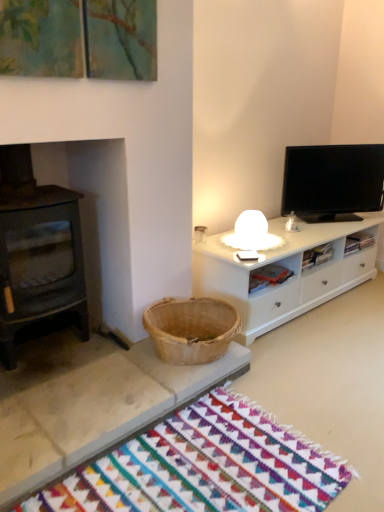
The image size is (384, 512). What do you see at coordinates (333, 181) in the screenshot?
I see `black glossy tv at upper right` at bounding box center [333, 181].

What is the approximate width of black glossy tv at upper right?

black glossy tv at upper right is 14.01 centimeters in width.

Identify the location of black glossy tv at upper right. (333, 181).

What do you see at coordinates (205, 467) in the screenshot? Image resolution: width=384 pixels, height=512 pixels. I see `multicolored woven mat at lower center` at bounding box center [205, 467].

Identify the location of multicolored woven mat at lower center. (205, 467).

At what (x,y) coordinates should I click in order to perform the action: click on black glossy tv at upper right. Please return your answer as a coordinate pair (x, y). This screenshot has height=512, width=384. Looking at the image, I should click on (333, 181).

Between black glossy tv at upper right and multicolored woven mat at lower center, which one appears on the right side from the viewer's perspective?

Positioned to the right is black glossy tv at upper right.

Is black glossy tv at upper right further to camera compared to multicolored woven mat at lower center?

Yes.

Which is nearer, (336, 196) or (67, 480)?

Point (336, 196) is positioned farther from the camera compared to point (67, 480).

From the image's perspective, is black glossy tv at upper right located above or below multicolored woven mat at lower center?

Clearly, from the image's perspective, black glossy tv at upper right is above multicolored woven mat at lower center.

From a real-world perspective, which is physically below, black glossy tv at upper right or multicolored woven mat at lower center?

multicolored woven mat at lower center.

Does black glossy tv at upper right have a lesser width compared to multicolored woven mat at lower center?

Correct, the width of black glossy tv at upper right is less than that of multicolored woven mat at lower center.

Who is shorter, black glossy tv at upper right or multicolored woven mat at lower center?

multicolored woven mat at lower center.

Is black glossy tv at upper right bigger or smaller than multicolored woven mat at lower center?

black glossy tv at upper right is bigger than multicolored woven mat at lower center.

Is multicolored woven mat at lower center a part of black glossy tv at upper right?

No, multicolored woven mat at lower center is not inside black glossy tv at upper right.

Is the surface of black glossy tv at upper right in direct contact with multicolored woven mat at lower center?

No, black glossy tv at upper right is not beside multicolored woven mat at lower center.

Does black glossy tv at upper right turn towards multicolored woven mat at lower center?

No.

Looking at this image, what's the angular difference between black glossy tv at upper right and multicolored woven mat at lower center's facing directions?

The angular difference between black glossy tv at upper right and multicolored woven mat at lower center is 28.7 degrees.

Locate an element on the screen. This screenshot has width=384, height=512. television that is above the multicolored woven mat at lower center (from a real-world perspective) is located at coordinates (333, 181).

From the picture: Is multicolored woven mat at lower center at the left side of black glossy tv at upper right?

Yes, multicolored woven mat at lower center is to the left of black glossy tv at upper right.

Does multicolored woven mat at lower center lie behind black glossy tv at upper right?

No, the depth of multicolored woven mat at lower center is less than that of black glossy tv at upper right.

Does point (174, 462) lie behind point (360, 203)?

No, it is not.

From the image's perspective, is multicolored woven mat at lower center located above or below black glossy tv at upper right?

Based on their image positions, multicolored woven mat at lower center is located beneath black glossy tv at upper right.

Based on the photo, from a real-world perspective, is multicolored woven mat at lower center above or below black glossy tv at upper right?

Clearly, from a real-world perspective, multicolored woven mat at lower center is below black glossy tv at upper right.

Considering the relative sizes of multicolored woven mat at lower center and black glossy tv at upper right in the image provided, is multicolored woven mat at lower center wider than black glossy tv at upper right?

Indeed, multicolored woven mat at lower center has a greater width compared to black glossy tv at upper right.

Can you confirm if multicolored woven mat at lower center is shorter than black glossy tv at upper right?

Indeed, multicolored woven mat at lower center has a lesser height compared to black glossy tv at upper right.

Considering the sizes of objects multicolored woven mat at lower center and black glossy tv at upper right in the image provided, who is bigger, multicolored woven mat at lower center or black glossy tv at upper right?

With larger size is black glossy tv at upper right.

Is multicolored woven mat at lower center located outside black glossy tv at upper right?

Indeed, multicolored woven mat at lower center is completely outside black glossy tv at upper right.

Is the surface of multicolored woven mat at lower center in direct contact with black glossy tv at upper right?

No, multicolored woven mat at lower center is not making contact with black glossy tv at upper right.

Is multicolored woven mat at lower center turned away from black glossy tv at upper right?

A: multicolored woven mat at lower center is not turned away from black glossy tv at upper right.

Measure the distance from multicolored woven mat at lower center to black glossy tv at upper right.

multicolored woven mat at lower center and black glossy tv at upper right are 5.84 feet apart from each other.

Where is `television on the right of multicolored woven mat at lower center`? This screenshot has width=384, height=512. television on the right of multicolored woven mat at lower center is located at coordinates (333, 181).

At what (x,y) coordinates should I click in order to perform the action: click on mat below the black glossy tv at upper right (from the image's perspective). Please return your answer as a coordinate pair (x, y). The height and width of the screenshot is (512, 384). Looking at the image, I should click on (205, 467).

I want to click on television on the right of multicolored woven mat at lower center, so click(x=333, y=181).